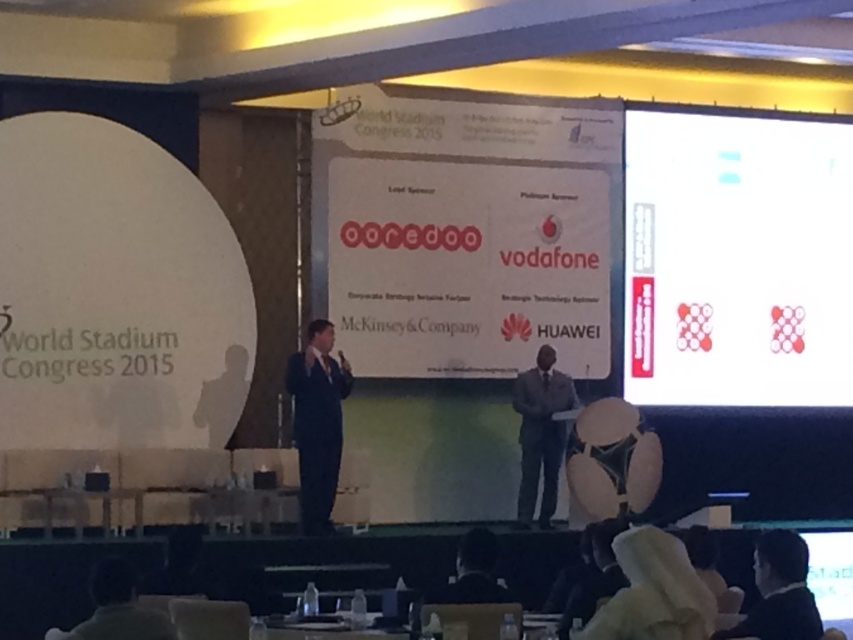
You are a photographer positioned at the back of the venue and want to capture a photo that includes both the white paper at upper right and the dark gray suit at center. Which object should you adjust your camera focus on first to ensure both are in focus?

The white paper at upper right is further to the viewer than the dark gray suit at center. To ensure both are in focus, focus on the white paper at upper right first, as it is closer, and the dark gray suit at center will fall within the depth of field.

You are an event organizer who needs to determine if a new banner can be placed above the white paper at upper right without covering the black suit at lower right. Based on their sizes, is this possible?

The white paper at upper right is bigger than the black suit at lower right. Therefore, placing a banner above the white paper at upper right might not cover the black suit at lower right since the white paper is larger, but the exact placement depends on the banner size and positioning.

Based on the photo, you are an event organizer who needs to place a new banner on the stage. The banner must be placed at point (737, 257). What object is currently located at that point?

At point (737, 257) lies white paper at upper right.